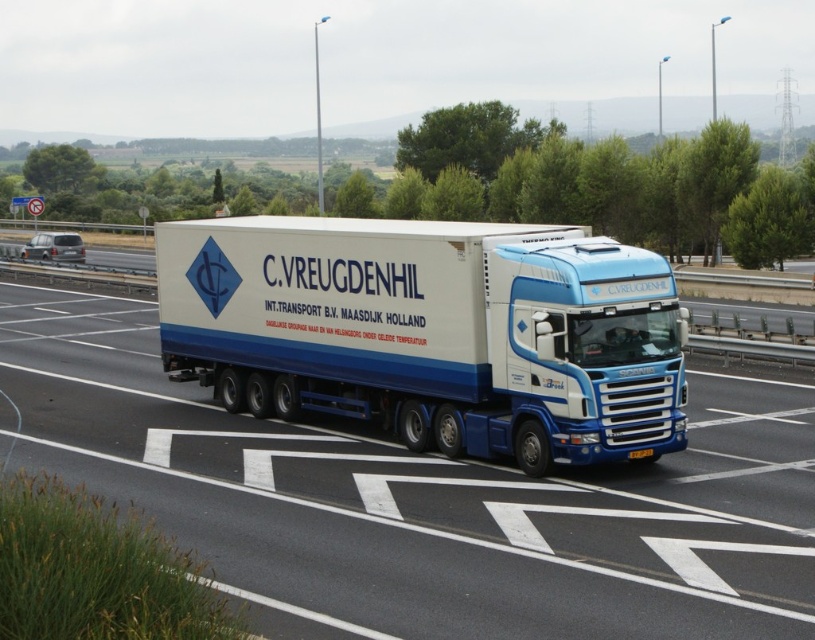
You are a traffic controller observing a highway scene. You notice a point marked at coordinates (421, 500). What object is located at this point?

The point at coordinates (421, 500) marks the white matte truck at center.

You are a traffic officer observing a blue metallic truck at center driving on a highway. You notice a yellow matte license plate at center attached to it. Based on their sizes, which object would be easier to see from a distance? Explain your reasoning.

The blue metallic truck at center is larger in size than the yellow matte license plate at center, so the blue metallic truck at center would be easier to see from a distance because larger objects are more visible at greater distances compared to smaller ones.

You are a traffic officer observing a blue metallic truck at center and a yellow matte license plate at center on a highway. Which object is wider?

The blue metallic truck at center is wider than the yellow matte license plate at center.